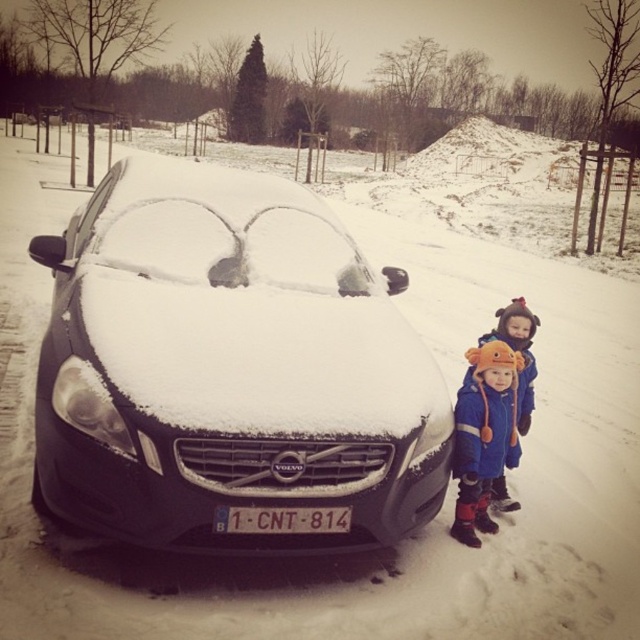
Does orange fleece hat at lower right have a greater width compared to white plastic license plate at center?

No.

Does point (496, 429) come farther from viewer compared to point (218, 509)?

Yes, point (496, 429) is behind point (218, 509).

Is point (493, 376) positioned before point (291, 515)?

No, it is behind (291, 515).

Find the location of `orange fleece hat at lower right`. orange fleece hat at lower right is located at coordinates (483, 435).

Which of these two, snow-covered metallic car at center or blue fuzzy hat at lower right, stands taller?

With more height is snow-covered metallic car at center.

Is snow-covered metallic car at center to the left of blue fuzzy hat at lower right from the viewer's perspective?

Correct, you'll find snow-covered metallic car at center to the left of blue fuzzy hat at lower right.

Is point (120, 508) behind point (497, 502)?

No, it is not.

This screenshot has width=640, height=640. In order to click on snow-covered metallic car at center in this screenshot , I will do `click(228, 368)`.

Does snow-covered metallic car at center have a lesser height compared to orange fleece hat at lower right?

Incorrect, snow-covered metallic car at center's height does not fall short of orange fleece hat at lower right's.

Does point (99, 506) lie behind point (500, 369)?

No.

Identify the location of snow-covered metallic car at center. The image size is (640, 640). (228, 368).